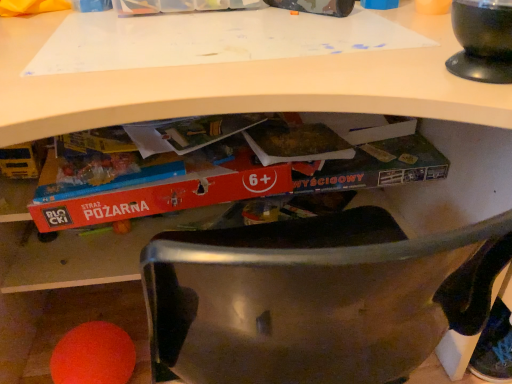
Question: Is black glossy bowl at upper right closer to the viewer compared to red cardboard book at center?

Choices:
 (A) no
 (B) yes

Answer: (B)

Question: Is black glossy bowl at upper right facing away from red cardboard book at center?

Choices:
 (A) no
 (B) yes

Answer: (A)

Question: Considering the relative sizes of black glossy bowl at upper right and red cardboard book at center in the image provided, is black glossy bowl at upper right smaller than red cardboard book at center?

Choices:
 (A) yes
 (B) no

Answer: (A)

Question: Is black glossy bowl at upper right far from red cardboard book at center?

Choices:
 (A) no
 (B) yes

Answer: (A)

Question: From the image's perspective, is black glossy bowl at upper right above red cardboard book at center?

Choices:
 (A) no
 (B) yes

Answer: (B)

Question: Can you confirm if black glossy bowl at upper right is shorter than red cardboard book at center?

Choices:
 (A) yes
 (B) no

Answer: (A)

Question: Does red cardboard book at center have a smaller size compared to black glossy bowl at upper right?

Choices:
 (A) no
 (B) yes

Answer: (A)

Question: Is red cardboard book at center positioned before black glossy bowl at upper right?

Choices:
 (A) yes
 (B) no

Answer: (B)

Question: From the image's perspective, would you say red cardboard book at center is positioned over black glossy bowl at upper right?

Choices:
 (A) yes
 (B) no

Answer: (B)

Question: Does red cardboard book at center have a lesser height compared to black glossy bowl at upper right?

Choices:
 (A) no
 (B) yes

Answer: (A)

Question: Is red cardboard book at center placed right next to black glossy bowl at upper right?

Choices:
 (A) no
 (B) yes

Answer: (A)

Question: Is red cardboard book at center not near black glossy bowl at upper right?

Choices:
 (A) no
 (B) yes

Answer: (A)

Question: Is black glossy bowl at upper right wider or thinner than red cardboard book at center?

Choices:
 (A) wide
 (B) thin

Answer: (B)